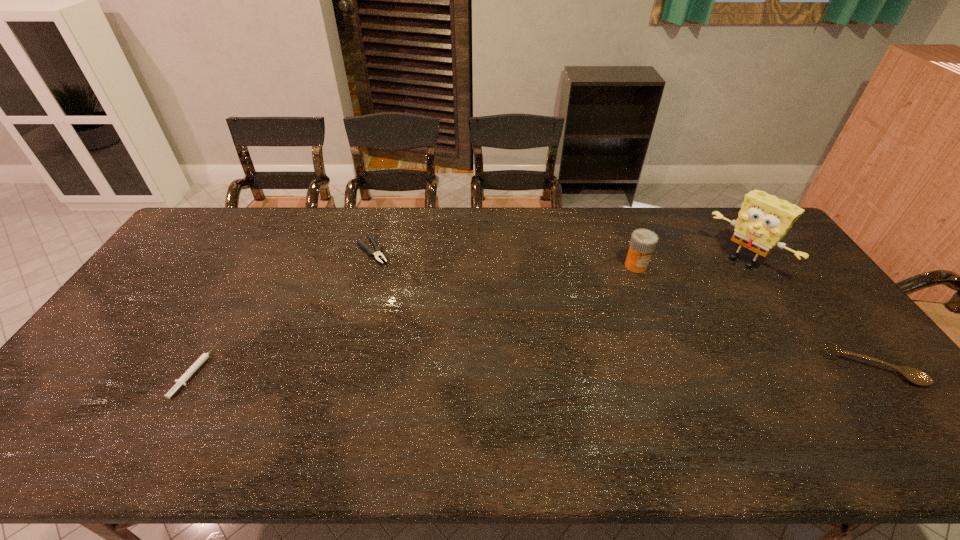
The image size is (960, 540). Find the location of `empty location between the third shortest object and the tallest object`. empty location between the third shortest object and the tallest object is located at coordinates (808, 314).

Locate an element on the screen. The width and height of the screenshot is (960, 540). vacant space in between the pliers and the ladle is located at coordinates (622, 309).

Where is `vacant region between the fourth shortest object and the pliers`? This screenshot has width=960, height=540. vacant region between the fourth shortest object and the pliers is located at coordinates [504, 258].

You are a GUI agent. You are given a task and a screenshot of the screen. Output one action in this format:
    pyautogui.click(x=<x>, y=<y>)
    Task: Click on the vacant point located between the third shortest object and the second object from left to right
    The height and width of the screenshot is (540, 960).
    Given the screenshot: What is the action you would take?
    pyautogui.click(x=622, y=309)

You are a GUI agent. You are given a task and a screenshot of the screen. Output one action in this format:
    pyautogui.click(x=<x>, y=<y>)
    Task: Click on the vacant area that lies between the ladle and the sponge
    
    Given the screenshot: What is the action you would take?
    pyautogui.click(x=808, y=314)

What are the coordinates of `free space between the medicine and the tallest object` in the screenshot? It's located at (690, 263).

I want to click on free space between the syringe and the ladle, so click(534, 369).

I want to click on free spot between the medicine and the syringe, so click(416, 318).

Identify the location of free space between the third object from right to left and the third tallest object. The height and width of the screenshot is (540, 960). (755, 316).

The height and width of the screenshot is (540, 960). Identify the location of object that is the closest to the sponge. tap(643, 242).